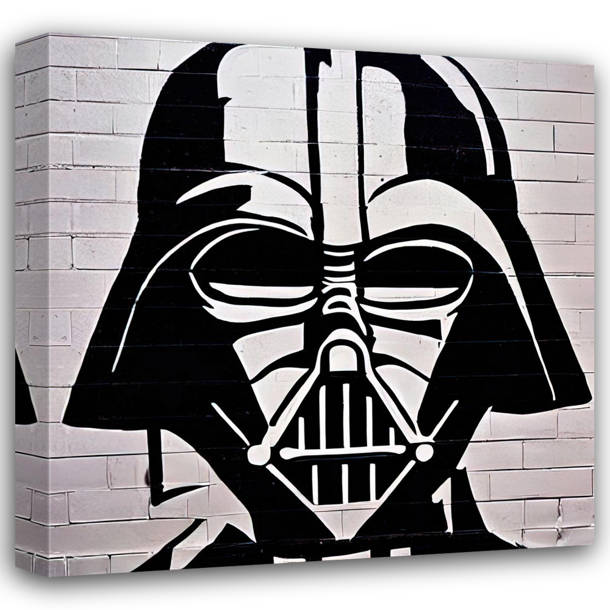
What are the coordinates of `canvas` in the screenshot? It's located at (77, 85), (95, 503), (554, 105), (564, 256), (554, 474), (96, 249), (32, 94), (29, 503).